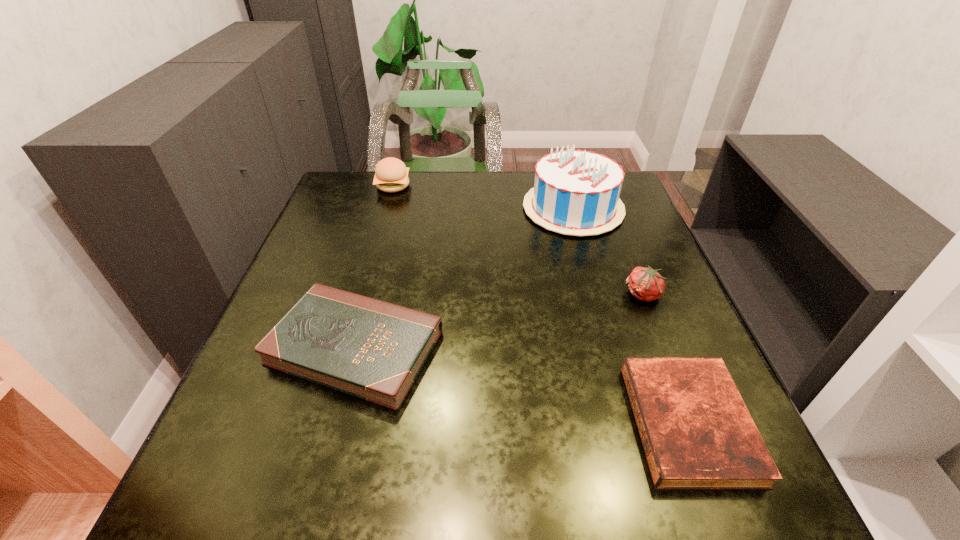
The width and height of the screenshot is (960, 540). Identify the location of free space that satisfies the following two spatial constraints: 1. on the front side of the third shortest object; 2. on the spine side of the shorter Bible. point(694,423).

At what (x,y) coordinates should I click in order to perform the action: click on free location that satisfies the following two spatial constraints: 1. on the back side of the second shortest object; 2. on the right side of the tomato. Please return your answer as a coordinate pair (x, y). This screenshot has height=540, width=960. Looking at the image, I should click on click(369, 294).

At what (x,y) coordinates should I click in order to perform the action: click on blank area in the image that satisfies the following two spatial constraints: 1. on the front side of the third tallest object; 2. on the left side of the fourth shortest object. Please return your answer as a coordinate pair (x, y). The width and height of the screenshot is (960, 540). Looking at the image, I should click on (362, 294).

This screenshot has height=540, width=960. I want to click on free location that satisfies the following two spatial constraints: 1. on the front side of the tallest object; 2. on the right side of the second tallest object, so click(x=387, y=208).